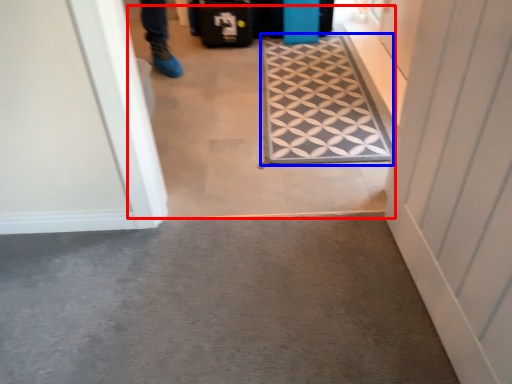
Question: Which object appears closest to the camera in this image, passage (highlighted by a red box) or doormat (highlighted by a blue box)?

Choices:
 (A) passage
 (B) doormat

Answer: (A)